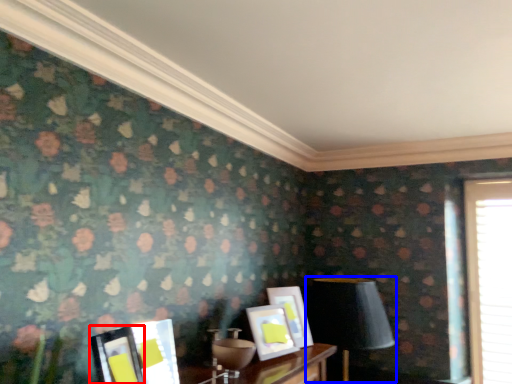
Question: Which object is closer to the camera taking this photo, picture frame (highlighted by a red box) or table lamp (highlighted by a blue box)?

Choices:
 (A) picture frame
 (B) table lamp

Answer: (A)